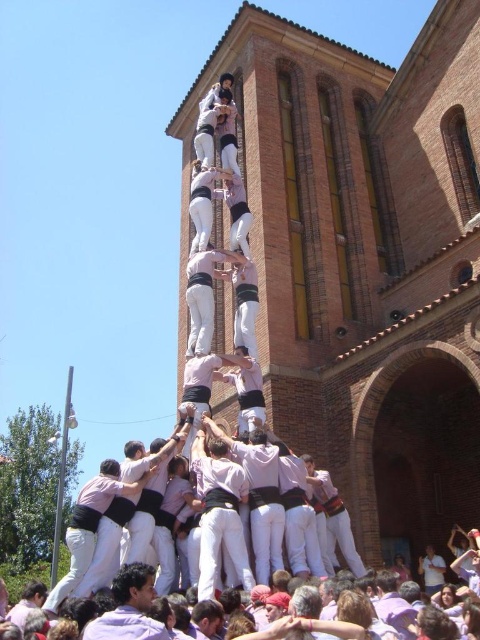
Question: Does white cotton crowd at center have a larger size compared to pink cotton shirt at center?

Choices:
 (A) no
 (B) yes

Answer: (B)

Question: Does white cotton crowd at center lie behind pink cotton shirt at center?

Choices:
 (A) no
 (B) yes

Answer: (B)

Question: Observing the image, what is the correct spatial positioning of white cotton crowd at center in reference to white cotton shirt at center?

Choices:
 (A) above
 (B) below

Answer: (B)

Question: Which point is closer to the camera?

Choices:
 (A) white cotton crowd at center
 (B) white cotton shirt at center

Answer: (A)

Question: Which is farther from the white cotton crowd at center?

Choices:
 (A) white cotton shirt at center
 (B) pink cotton shirt at center

Answer: (A)

Question: Which object is farther from the camera taking this photo?

Choices:
 (A) white cotton shirt at center
 (B) white cotton crowd at center
 (C) pink cotton shirt at center

Answer: (A)